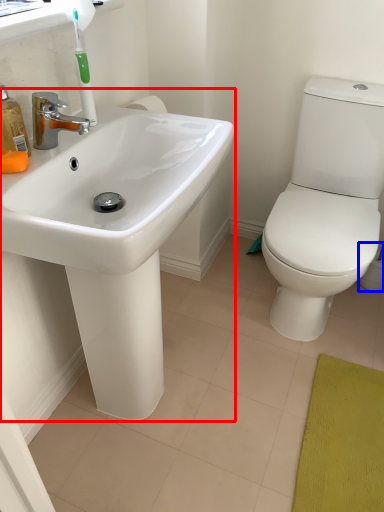
Question: Among these objects, which one is farthest to the camera, sink (highlighted by a red box) or toilet paper (highlighted by a blue box)?

Choices:
 (A) sink
 (B) toilet paper

Answer: (B)